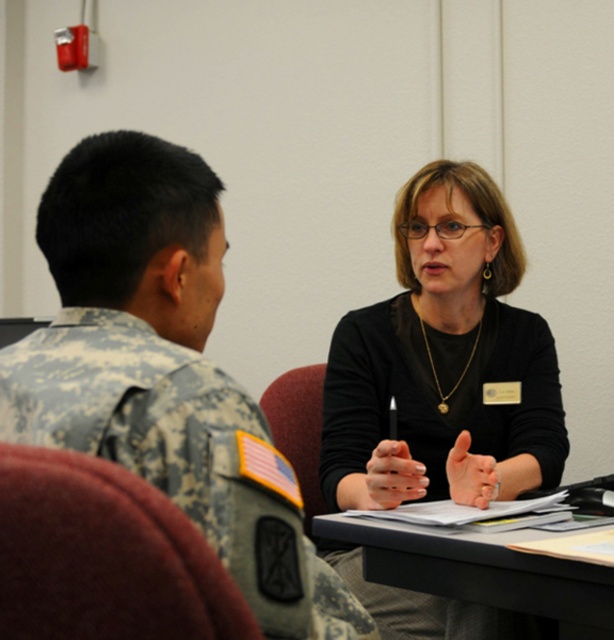
Is camouflage uniform at left further to camera compared to black plastic table at center?

No, it is in front of black plastic table at center.

Who is positioned more to the left, camouflage uniform at left or black plastic table at center?

camouflage uniform at left

Is point (63, 234) positioned in front of point (476, 588)?

Yes, point (63, 234) is closer to viewer.

This screenshot has width=614, height=640. In order to click on camouflage uniform at left in this screenshot , I will do `click(165, 372)`.

Can you confirm if camouflage uniform at left is positioned below black matte shirt at center?

Incorrect, camouflage uniform at left is not positioned below black matte shirt at center.

Which is below, camouflage uniform at left or black matte shirt at center?

black matte shirt at center is lower down.

The height and width of the screenshot is (640, 614). I want to click on camouflage uniform at left, so click(165, 372).

I want to click on camouflage uniform at left, so click(x=165, y=372).

Consider the image. Can you confirm if black matte shirt at center is positioned above black plastic table at center?

Indeed, black matte shirt at center is positioned over black plastic table at center.

Between black matte shirt at center and black plastic table at center, which one is positioned lower?

black plastic table at center is below.

What do you see at coordinates (443, 362) in the screenshot? The image size is (614, 640). I see `black matte shirt at center` at bounding box center [443, 362].

What are the coordinates of `black matte shirt at center` in the screenshot? It's located at (443, 362).